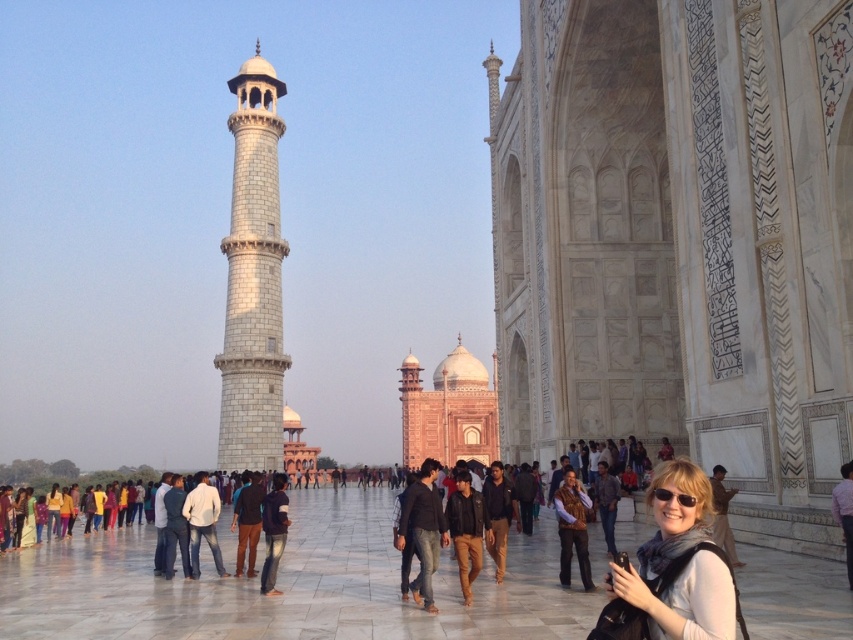
You are a tourist visiting the Taj Mahal and want to take a photo of the dark blue fabric jacket at center and the matte black sunglasses at lower right in the same frame. Based on their positions, which object should you focus on first to ensure both are in the shot?

The dark blue fabric jacket at center is to the left of the matte black sunglasses at lower right, so you should focus on the dark blue fabric jacket at center first to ensure both are in the shot.

You are a photographer standing in the courtyard of the Taj Mahal. You notice a dark blue fabric jacket at center and a matte black sunglasses at lower right. Which object is closer to the ground?

The dark blue fabric jacket at center is positioned under matte black sunglasses at lower right, so the dark blue fabric jacket at center is closer to the ground.